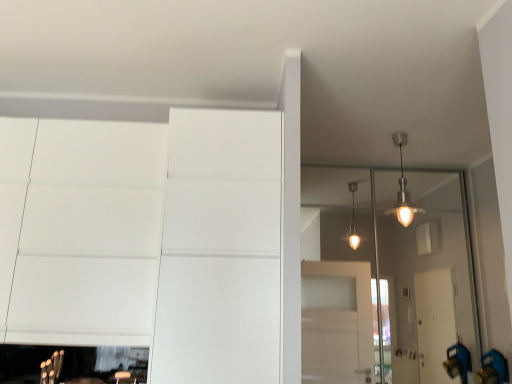
I want to click on transparent glass door at upper right, so click(x=403, y=255).

What do you see at coordinates (403, 255) in the screenshot? This screenshot has height=384, width=512. I see `transparent glass door at upper right` at bounding box center [403, 255].

Locate an element on the screen. Image resolution: width=512 pixels, height=384 pixels. white matte dresser at lower left is located at coordinates (149, 240).

Measure the distance between point (117,186) and camera.

Point (117,186) is 8.01 feet away from camera.

The height and width of the screenshot is (384, 512). What do you see at coordinates (149, 240) in the screenshot?
I see `white matte dresser at lower left` at bounding box center [149, 240].

This screenshot has width=512, height=384. In order to click on transparent glass door at upper right in this screenshot , I will do `click(403, 255)`.

Between transparent glass door at upper right and white matte dresser at lower left, which one appears on the left side from the viewer's perspective?

white matte dresser at lower left is more to the left.

From the picture: Is transparent glass door at upper right further to camera compared to white matte dresser at lower left?

Yes, it is.

Is point (376, 209) in front of point (143, 330)?

No, (376, 209) is further to viewer.

From the image's perspective, is transparent glass door at upper right located above or below white matte dresser at lower left?

Based on their image positions, transparent glass door at upper right is located beneath white matte dresser at lower left.

From a real-world perspective, which object rests below the other?

From a 3D spatial view, transparent glass door at upper right is below.

Looking at this image, between transparent glass door at upper right and white matte dresser at lower left, which one has smaller width?

Thinner between the two is transparent glass door at upper right.

In terms of height, does transparent glass door at upper right look taller or shorter compared to white matte dresser at lower left?

In the image, transparent glass door at upper right appears to be taller than white matte dresser at lower left.

Can you confirm if transparent glass door at upper right is bigger than white matte dresser at lower left?

Incorrect, transparent glass door at upper right is not larger than white matte dresser at lower left.

Is transparent glass door at upper right completely or partially outside of white matte dresser at lower left?

That's correct, transparent glass door at upper right is outside of white matte dresser at lower left.

Is transparent glass door at upper right touching white matte dresser at lower left?

transparent glass door at upper right is not next to white matte dresser at lower left, and they're not touching.

Is transparent glass door at upper right facing towards white matte dresser at lower left?

No, transparent glass door at upper right is not aimed at white matte dresser at lower left.

Image resolution: width=512 pixels, height=384 pixels. What are the coordinates of `glass door below the white matte dresser at lower left (from the image's perspective)` in the screenshot? It's located at (403, 255).

In the scene shown: Considering the relative positions of white matte dresser at lower left and transparent glass door at upper right in the image provided, is white matte dresser at lower left to the left or to the right of transparent glass door at upper right?

From the image, it's evident that white matte dresser at lower left is to the left of transparent glass door at upper right.

Is white matte dresser at lower left in front of or behind transparent glass door at upper right in the image?

Clearly, white matte dresser at lower left is in front of transparent glass door at upper right.

Is point (183, 189) closer to viewer compared to point (355, 168)?

Yes, point (183, 189) is closer to viewer.

From the image's perspective, would you say white matte dresser at lower left is positioned over transparent glass door at upper right?

Yes, from the image's perspective, white matte dresser at lower left is over transparent glass door at upper right.

From a real-world perspective, is white matte dresser at lower left physically located above or below transparent glass door at upper right?

white matte dresser at lower left is situated higher than transparent glass door at upper right in the real world.

Is white matte dresser at lower left thinner than transparent glass door at upper right?

No.

From the picture: Does white matte dresser at lower left have a lesser height compared to transparent glass door at upper right?

Indeed, white matte dresser at lower left has a lesser height compared to transparent glass door at upper right.

Considering the sizes of white matte dresser at lower left and transparent glass door at upper right in the image, is white matte dresser at lower left bigger or smaller than transparent glass door at upper right?

In the image, white matte dresser at lower left appears to be larger than transparent glass door at upper right.

Is white matte dresser at lower left inside the boundaries of transparent glass door at upper right, or outside?

white matte dresser at lower left cannot be found inside transparent glass door at upper right.

Are white matte dresser at lower left and transparent glass door at upper right making contact?

No, white matte dresser at lower left is not beside transparent glass door at upper right.

Could you tell me if white matte dresser at lower left is facing transparent glass door at upper right?

No.

How many degrees apart are the facing directions of white matte dresser at lower left and transparent glass door at upper right?

0.268 degrees separate the facing orientations of white matte dresser at lower left and transparent glass door at upper right.

Locate an element on the screen. The height and width of the screenshot is (384, 512). dresser above the transparent glass door at upper right (from a real-world perspective) is located at coordinates (149, 240).

The image size is (512, 384). Identify the location of dresser that appears on the left of transparent glass door at upper right. (149, 240).

Identify the location of glass door below the white matte dresser at lower left (from the image's perspective). [403, 255].